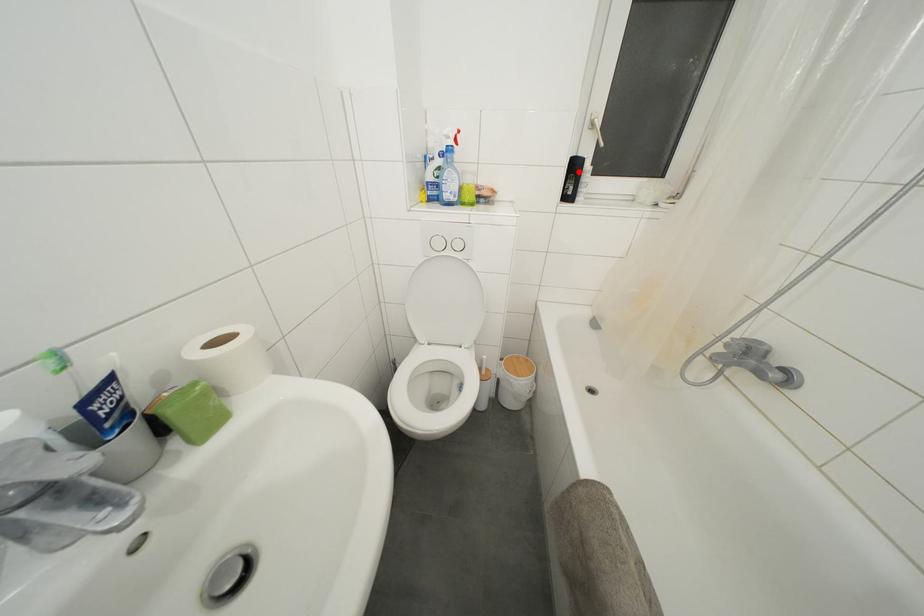
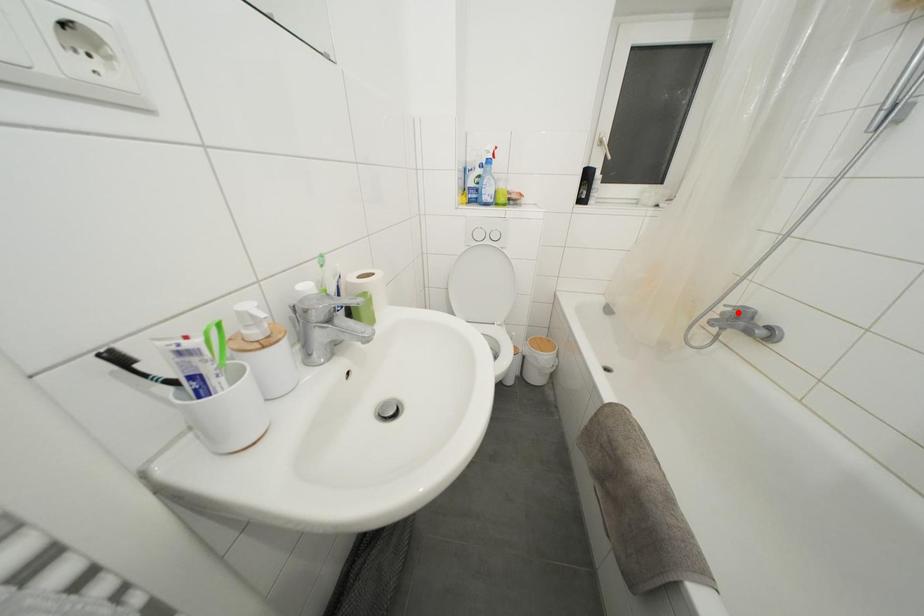
I am providing you with two images of the same scene from different viewpoints. A red point is marked on the first image and another point is marked on the second image. Are the points marked in image1 and image2 representing the same 3D position?

No